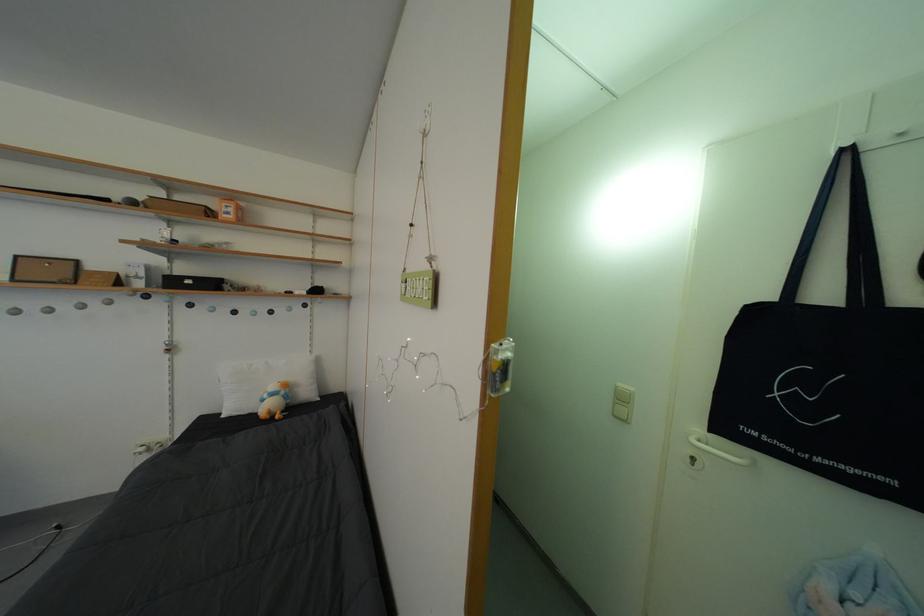
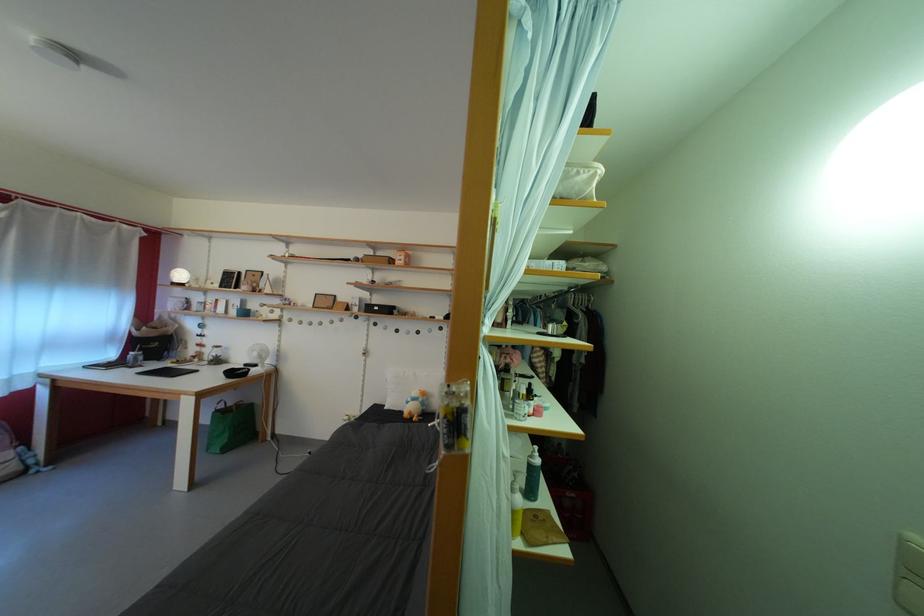
Where in the second image is the point corresponding to (x=625, y=392) from the first image?

(913, 545)